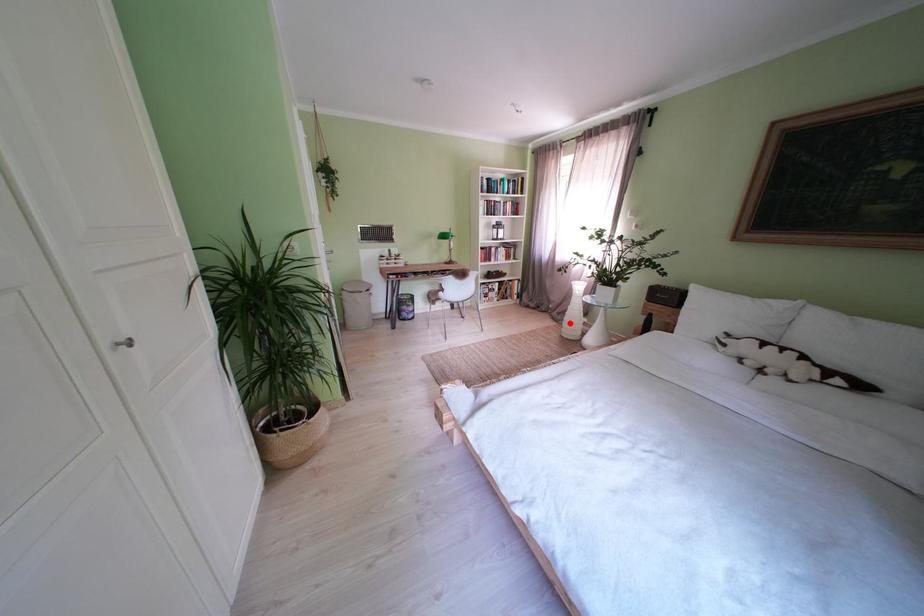
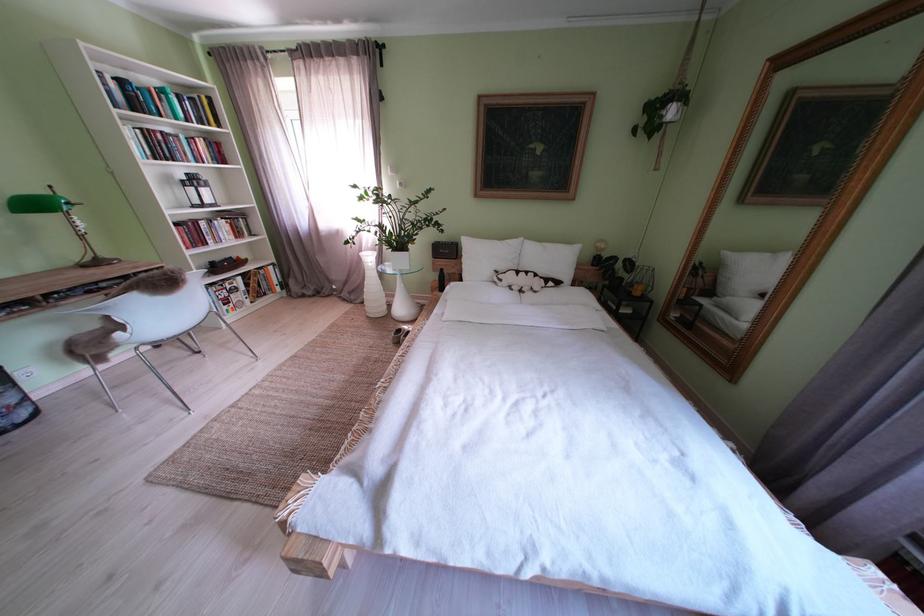
Where in the second image is the point corresponding to the highlighted location from the first image?

(363, 302)